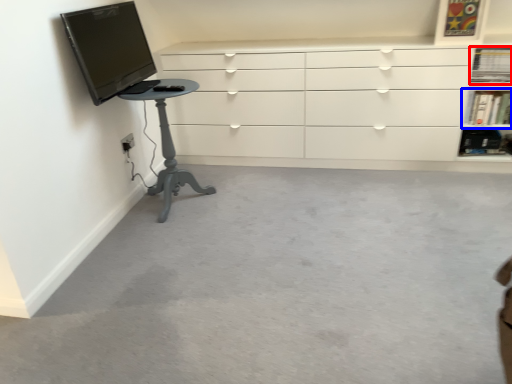
Question: Which of the following is the closest to the observer, shelf (highlighted by a red box) or shelf (highlighted by a blue box)?

Choices:
 (A) shelf
 (B) shelf

Answer: (A)